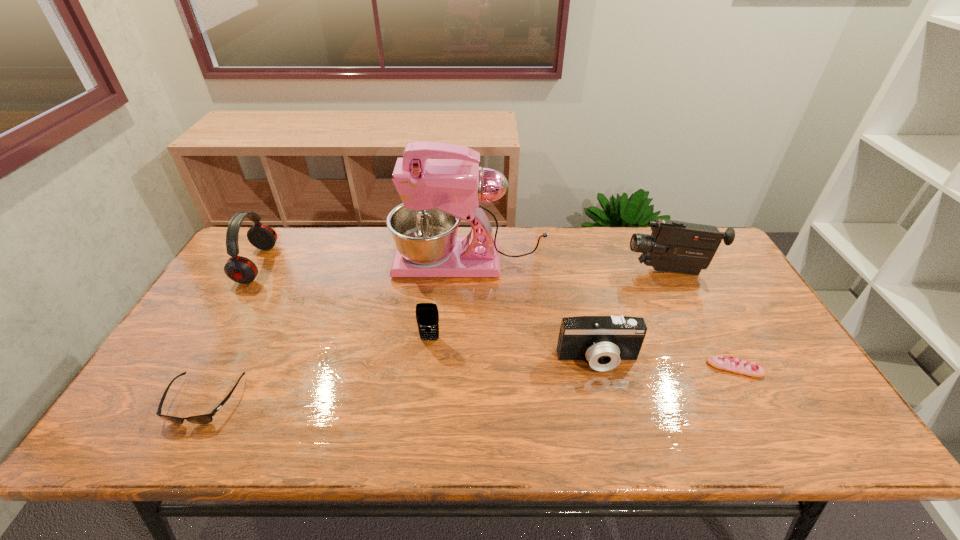
You are a GUI agent. You are given a task and a screenshot of the screen. Output one action in this format:
    pyautogui.click(x=<x>, y=<y>)
    Task: Click on the camcorder that is at the far edge
    The width and height of the screenshot is (960, 540).
    Given the screenshot: What is the action you would take?
    pyautogui.click(x=676, y=246)

Identify the location of earphone at the far edge. (242, 270).

Find the location of a particular element. object present at the near edge is located at coordinates (206, 418).

In order to click on earphone that is at the left edge in this screenshot , I will do `click(242, 270)`.

Locate an element on the screen. sunglasses that is at the left edge is located at coordinates (206, 418).

Where is `camcorder at the right edge`? camcorder at the right edge is located at coordinates (676, 246).

Identify the location of eclair situated at the right edge. (738, 366).

You are a GUI agent. You are given a task and a screenshot of the screen. Output one action in this format:
    pyautogui.click(x=<x>, y=<y>)
    Task: Click on the object present at the far left corner
    
    Given the screenshot: What is the action you would take?
    pyautogui.click(x=242, y=270)

Find the location of a particular element. object present at the near left corner is located at coordinates (206, 418).

At what (x,y) coordinates should I click in order to perform the action: click on object positioned at the far right corner. Please return your answer as a coordinate pair (x, y). This screenshot has height=540, width=960. Looking at the image, I should click on (676, 246).